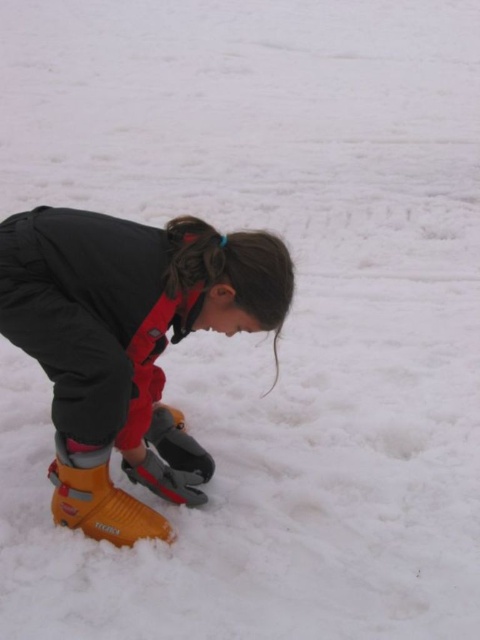
You are standing at the origin point of the coordinate system. You see an orange plastic ski boot at lower left located at point (128,344). If you walk straight ahead, will you step on the orange plastic ski boot at lower left before reaching the snowman?

The orange plastic ski boot at lower left is located at point (128,344), but there is no information about the snowman or its position in the scene. Therefore, it is impossible to determine whether stepping on the boot would occur before reaching the snowman.

You are helping organize winter gear in a storage room. You have two ski boots to place on a shelf. The orange plastic ski boot at lower left and the yellow plastic ski boot at lower left need to be arranged vertically. Since the shelf is only 30 cm tall, will both boots fit if placed side by side vertically?

The orange plastic ski boot at lower left is taller than the yellow plastic ski boot at lower left. If the shelf is only 30 cm tall, both boots might not fit vertically side by side because the taller orange boot may exceed the shelf height.

You are a winter sports instructor observing the orange plastic ski boot at lower left and the yellow plastic ski boot at lower left. Which boot is covering the other one?

The orange plastic ski boot at lower left is positioned over the yellow plastic ski boot at lower left, so it is covering the yellow one.